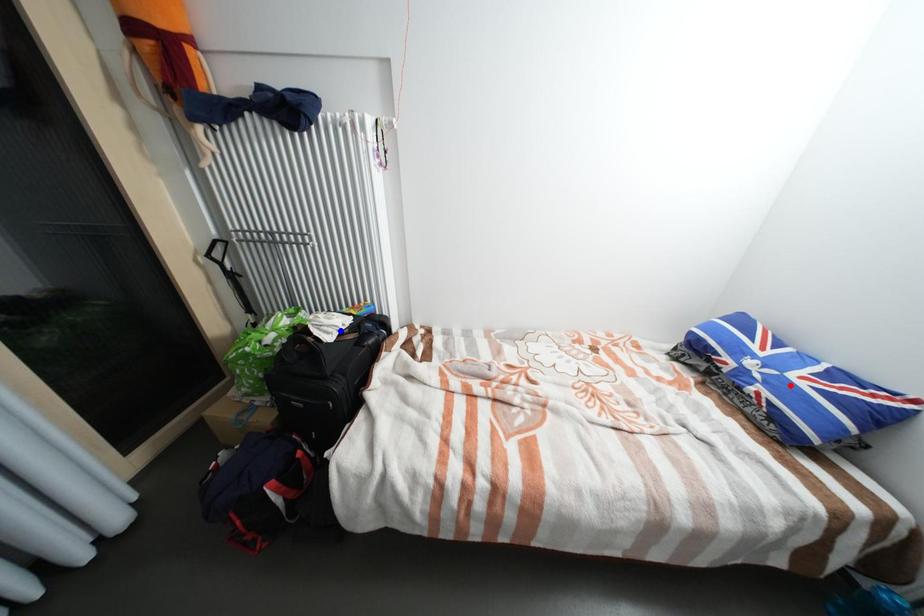
Question: Which of the two points in the image is closer to the camera?

Choices:
 (A) Blue point is closer.
 (B) Red point is closer.

Answer: (B)